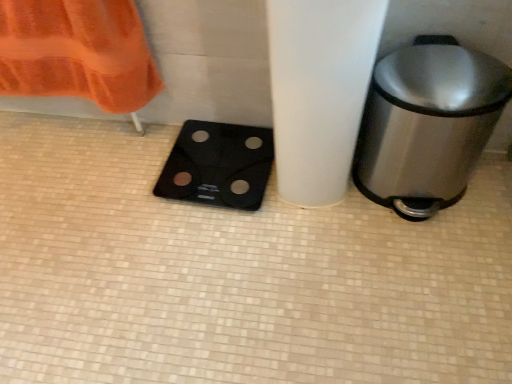
Locate an element on the screen. polished stainless steel trash can at right is located at coordinates (428, 124).

This screenshot has width=512, height=384. What do you see at coordinates (428, 124) in the screenshot?
I see `polished stainless steel trash can at right` at bounding box center [428, 124].

What do you see at coordinates (218, 165) in the screenshot?
I see `black glass scale at lower left` at bounding box center [218, 165].

Locate an element on the screen. black glass scale at lower left is located at coordinates [x=218, y=165].

Consider the image. What is the approximate height of black glass scale at lower left?

black glass scale at lower left is 1.50 inches in height.

Where is `polished stainless steel trash can at right`? This screenshot has height=384, width=512. polished stainless steel trash can at right is located at coordinates (428, 124).

Looking at this image, is black glass scale at lower left to the left of polished stainless steel trash can at right from the viewer's perspective?

Yes, black glass scale at lower left is to the left of polished stainless steel trash can at right.

From the picture: Does black glass scale at lower left come in front of polished stainless steel trash can at right?

No, black glass scale at lower left is further to the viewer.

Is point (165, 166) positioned behind point (466, 66)?

Yes, it is.

Looking at this image, from the image's perspective, relative to polished stainless steel trash can at right, is black glass scale at lower left above or below?

black glass scale at lower left is below polished stainless steel trash can at right.

From a real-world perspective, is black glass scale at lower left below polished stainless steel trash can at right?

Correct, in the physical world, black glass scale at lower left is lower than polished stainless steel trash can at right.

Which of these two, black glass scale at lower left or polished stainless steel trash can at right, is wider?

With larger width is black glass scale at lower left.

Which of these two, black glass scale at lower left or polished stainless steel trash can at right, stands shorter?

Standing shorter between the two is black glass scale at lower left.

Who is bigger, black glass scale at lower left or polished stainless steel trash can at right?

Bigger between the two is polished stainless steel trash can at right.

Would you say polished stainless steel trash can at right is part of black glass scale at lower left's contents?

→ No, black glass scale at lower left does not contain polished stainless steel trash can at right.

Is black glass scale at lower left placed right next to polished stainless steel trash can at right?

No, black glass scale at lower left is not making contact with polished stainless steel trash can at right.

Is black glass scale at lower left positioned with its back to polished stainless steel trash can at right?

No, black glass scale at lower left's orientation is not away from polished stainless steel trash can at right.

What are the coordinates of `appliance that appears below the polished stainless steel trash can at right (from a real-world perspective)` in the screenshot? It's located at (218, 165).

Would you say polished stainless steel trash can at right is to the left or to the right of black glass scale at lower left in the picture?

Clearly, polished stainless steel trash can at right is on the right of black glass scale at lower left in the image.

Between polished stainless steel trash can at right and black glass scale at lower left, which one is positioned in front?

polished stainless steel trash can at right is in front.

Is point (386, 124) positioned before point (224, 152)?

Yes, it is in front of point (224, 152).

From the image's perspective, between polished stainless steel trash can at right and black glass scale at lower left, which one is located above?

polished stainless steel trash can at right appears higher in the image.

From a real-world perspective, which is physically below, polished stainless steel trash can at right or black glass scale at lower left?

From a 3D spatial view, black glass scale at lower left is below.

Consider the image. Is polished stainless steel trash can at right wider than black glass scale at lower left?

In fact, polished stainless steel trash can at right might be narrower than black glass scale at lower left.

Is polished stainless steel trash can at right shorter than black glass scale at lower left?

No, polished stainless steel trash can at right is not shorter than black glass scale at lower left.

Looking at this image, who is bigger, polished stainless steel trash can at right or black glass scale at lower left?

polished stainless steel trash can at right is bigger.

Do you think polished stainless steel trash can at right is within black glass scale at lower left, or outside of it?

polished stainless steel trash can at right is located beyond the bounds of black glass scale at lower left.

Is polished stainless steel trash can at right far away from black glass scale at lower left?

Actually, polished stainless steel trash can at right and black glass scale at lower left are a little close together.

Is polished stainless steel trash can at right positioned with its back to black glass scale at lower left?

No, black glass scale at lower left is not at the back of polished stainless steel trash can at right.

Measure the distance from polished stainless steel trash can at right to black glass scale at lower left.

polished stainless steel trash can at right and black glass scale at lower left are 15.12 inches apart.

Where is `appliance below the polished stainless steel trash can at right (from a real-world perspective)`? appliance below the polished stainless steel trash can at right (from a real-world perspective) is located at coordinates (218, 165).

This screenshot has width=512, height=384. Find the location of `appliance that is behind the polished stainless steel trash can at right`. appliance that is behind the polished stainless steel trash can at right is located at coordinates (218, 165).

At what (x,y) coordinates should I click in order to perform the action: click on waste container located above the black glass scale at lower left (from a real-world perspective). Please return your answer as a coordinate pair (x, y). This screenshot has width=512, height=384. Looking at the image, I should click on pyautogui.click(x=428, y=124).